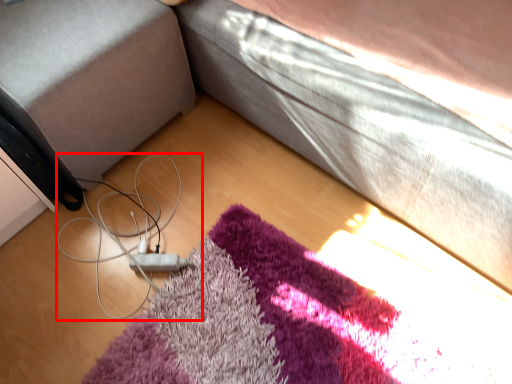
Question: From the image's perspective, considering the relative positions of cable (annotated by the red box) and gray in the image provided, where is cable (annotated by the red box) located with respect to the staircase?

Choices:
 (A) below
 (B) above

Answer: (A)